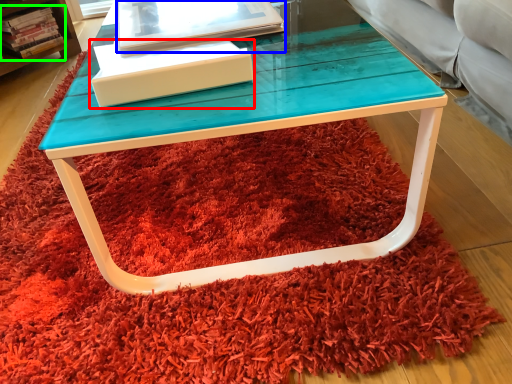
Question: Considering the real-world distances, which object is farthest from box (highlighted by a red box)? book (highlighted by a blue box) or book (highlighted by a green box)?

Choices:
 (A) book
 (B) book

Answer: (B)